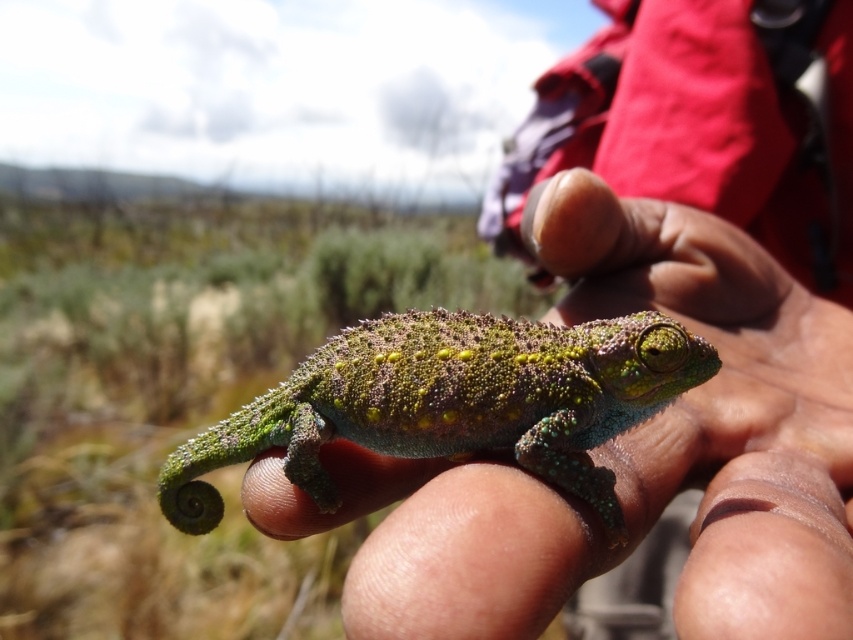
Which is in front, point (523, 531) or point (299, 433)?

Point (523, 531)

Is green scaly chameleon at center thinner than green scaly lizard at center?

In fact, green scaly chameleon at center might be wider than green scaly lizard at center.

Is point (802, 300) farther from camera compared to point (343, 378)?

Yes, point (802, 300) is farther from viewer.

At what (x,y) coordinates should I click in order to perform the action: click on green scaly chameleon at center. Please return your answer as a coordinate pair (x, y). Looking at the image, I should click on (625, 452).